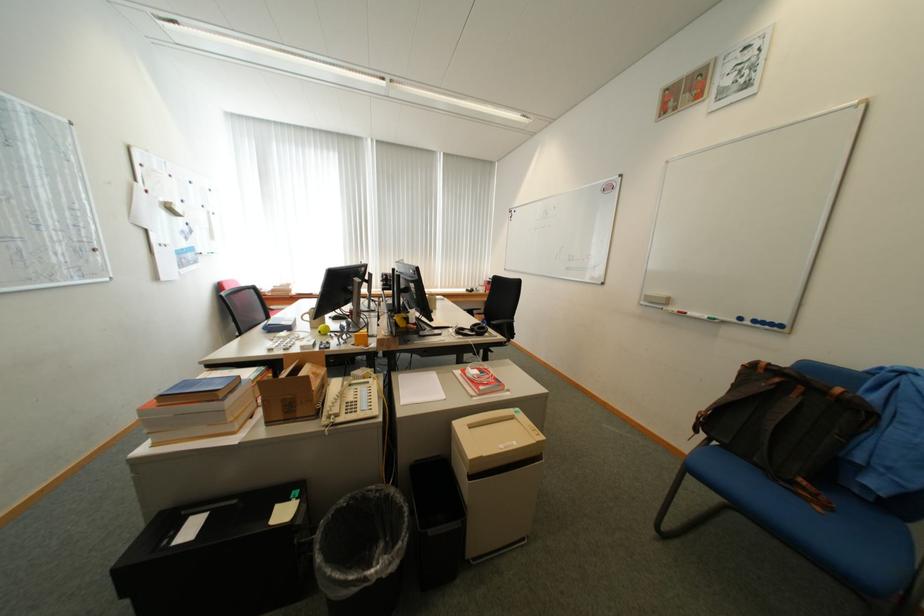
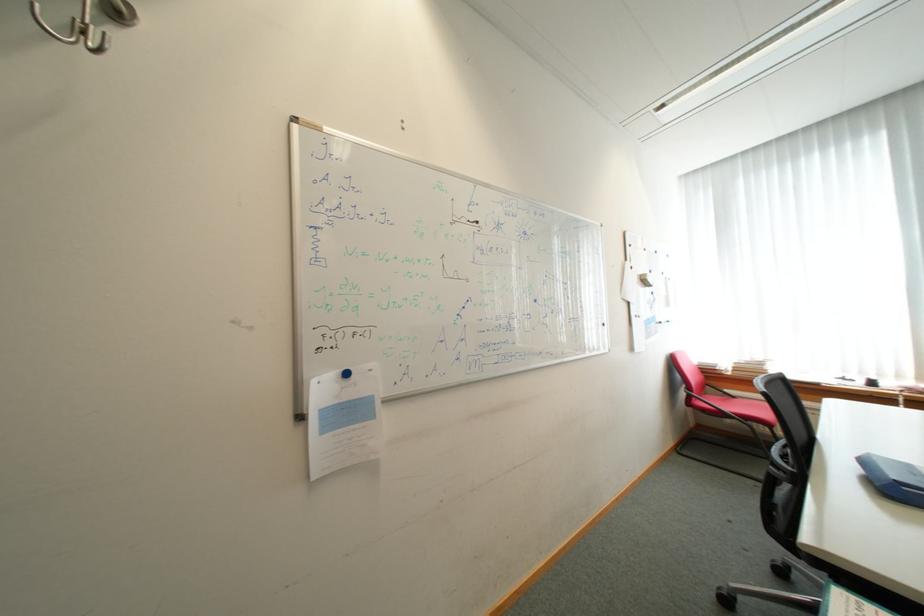
Question: Based on the continuous images, in which direction is the camera rotating? Reply with the corresponding letter.

Choices:
 (A) Left
 (B) Right
 (C) Up
 (D) Down

Answer: (A)